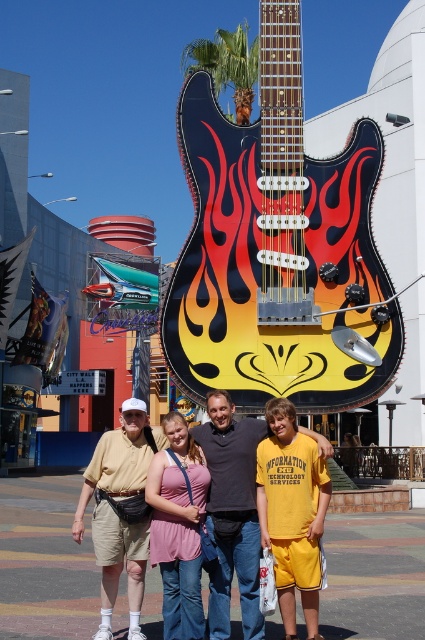
Question: Is flame-painted wood guitar at center below matte yellow shorts at center?

Choices:
 (A) no
 (B) yes

Answer: (A)

Question: Estimate the real-world distances between objects in this image. Which object is closer to the matte khaki shorts at center?

Choices:
 (A) flame-painted wood guitar at center
 (B) matte yellow shorts at center

Answer: (B)

Question: Observing the image, what is the correct spatial positioning of flame-painted wood guitar at center in reference to matte yellow shorts at center?

Choices:
 (A) below
 (B) above

Answer: (B)

Question: Which object is farther from the camera taking this photo?

Choices:
 (A) matte yellow shorts at center
 (B) flame-painted wood guitar at center

Answer: (B)

Question: Does matte khaki shorts at center have a smaller size compared to matte yellow shorts at center?

Choices:
 (A) no
 (B) yes

Answer: (B)

Question: Considering the real-world distances, which object is closest to the matte yellow shorts at center?

Choices:
 (A) matte khaki shorts at center
 (B) flame-painted wood guitar at center

Answer: (A)